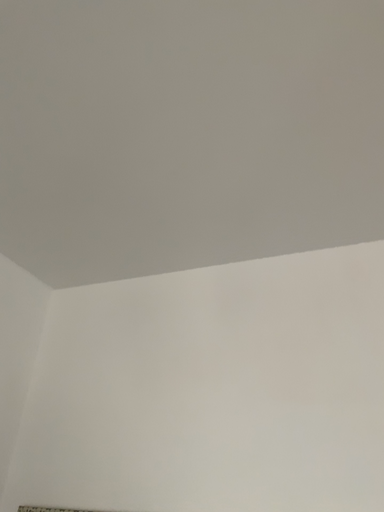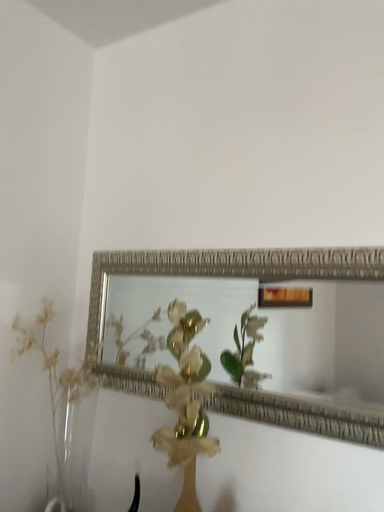
Question: How did the camera likely rotate when shooting the video?

Choices:
 (A) rotated downward
 (B) rotated upward

Answer: (A)